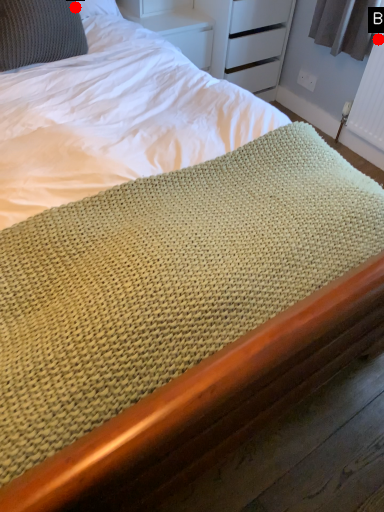
Question: Two points are circled on the image, labeled by A and B beside each circle. Which point is closer to the camera?

Choices:
 (A) A is closer
 (B) B is closer

Answer: (A)